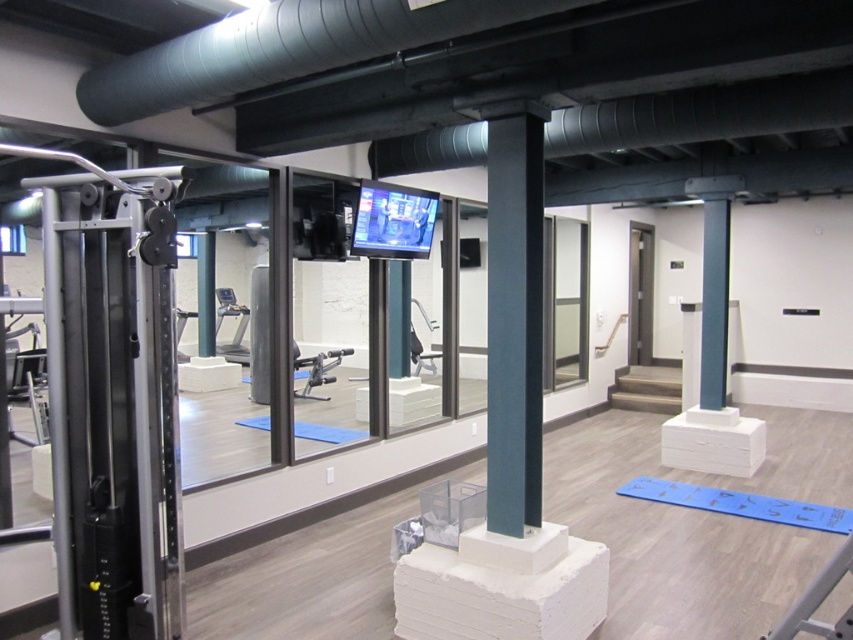
Is point (488, 225) closer to camera compared to point (366, 195)?

That is True.

Identify the location of satin dark green pole at center. This screenshot has height=640, width=853. (514, 323).

Between point (525, 371) and point (412, 211), which one is positioned behind?

The point (412, 211) is behind.

This screenshot has height=640, width=853. I want to click on satin dark green pole at center, so click(x=514, y=323).